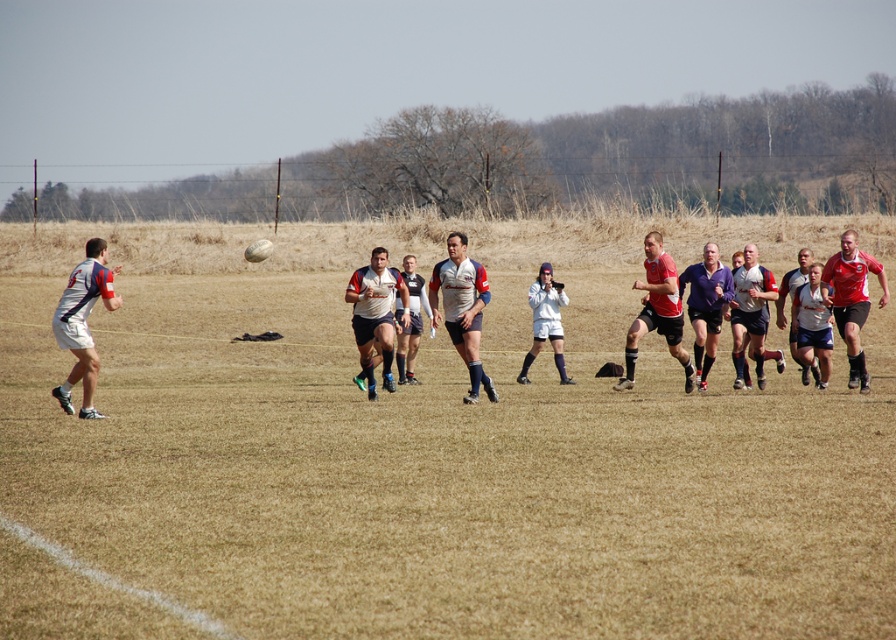
Question: Can you confirm if matte white rugby jersey at left is positioned to the left of red jersey at right?

Choices:
 (A) yes
 (B) no

Answer: (A)

Question: From the image, what is the correct spatial relationship of white jersey at center in relation to white matte jersey at center?

Choices:
 (A) left
 (B) right

Answer: (A)

Question: Does red jersey at right lie in front of purple matte shorts at center?

Choices:
 (A) yes
 (B) no

Answer: (A)

Question: Which object appears closest to the camera in this image?

Choices:
 (A) matte white rugby jersey at left
 (B) white matte jersey at center

Answer: (A)

Question: Which of the following is the closest to the observer?

Choices:
 (A) matte white rugby jersey at center
 (B) red jersey at right
 (C) red matte jersey at center

Answer: (A)

Question: Based on their relative distances, which object is farther from the red matte jersey at center?

Choices:
 (A) white jersey at center
 (B) matte white rugby jersey at left

Answer: (B)